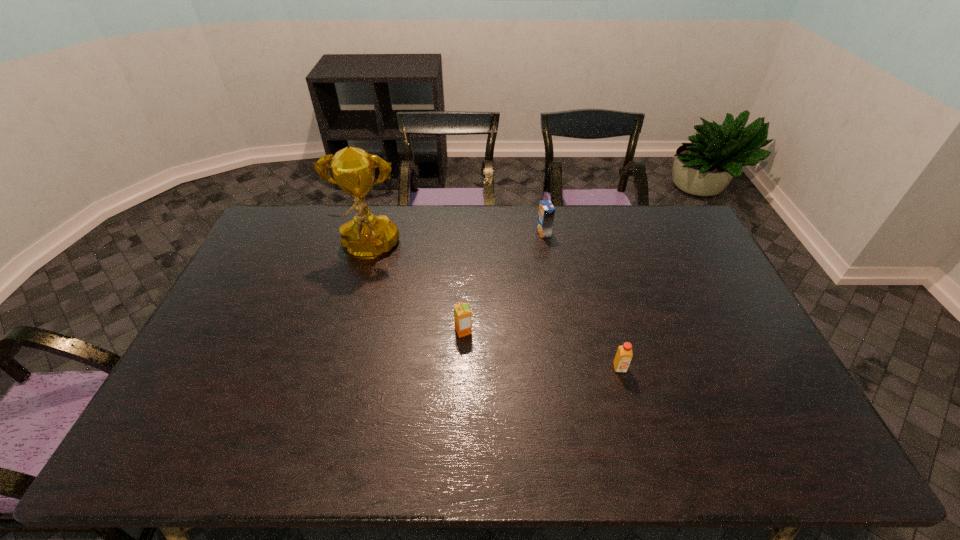
At what (x,y) coordinates should I click in order to perform the action: click on object that is the second closest to the farthest orange juice. Please return your answer as a coordinate pair (x, y). The height and width of the screenshot is (540, 960). Looking at the image, I should click on (366, 236).

Locate an element on the screen. The image size is (960, 540). object identified as the second closest to the third object from left to right is located at coordinates (366, 236).

The image size is (960, 540). I want to click on orange juice that is the nearest to the second nearest object, so click(x=624, y=354).

Find the location of a particular element. orange juice identified as the closest to the second object from right to left is located at coordinates (462, 314).

Where is `blank area in the image that satisfies the following two spatial constraints: 1. on the back side of the farthest orange juice; 2. on the left side of the second farthest orange juice`? blank area in the image that satisfies the following two spatial constraints: 1. on the back side of the farthest orange juice; 2. on the left side of the second farthest orange juice is located at coordinates (467, 232).